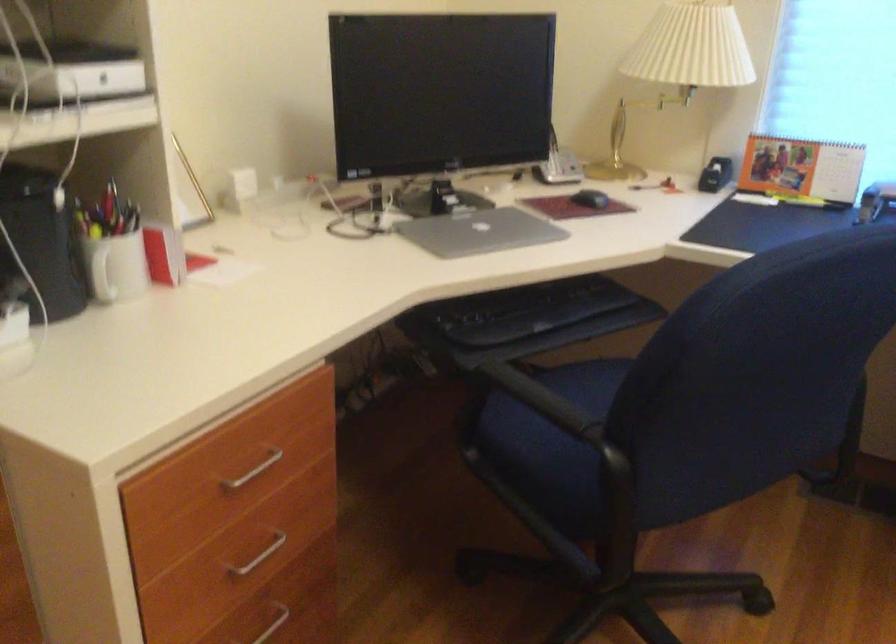
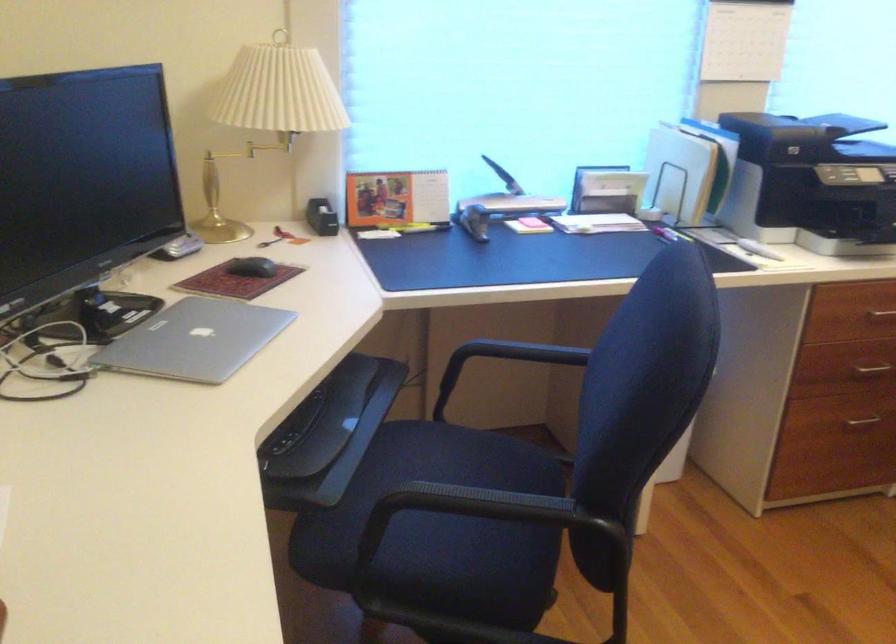
Find the pixel in the second image that matches (472,232) in the first image.

(194, 339)